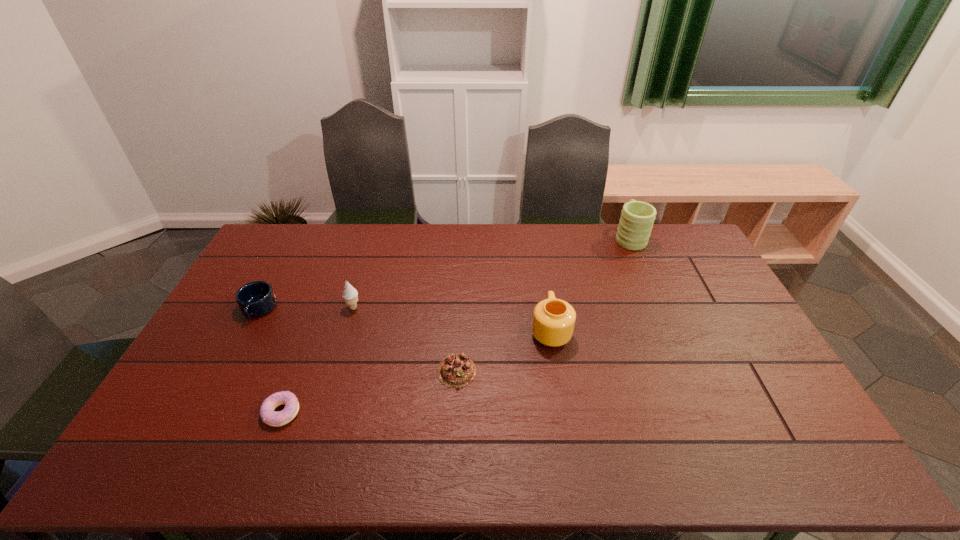
Where is `free space between the fifth farthest object and the shortest mug`? The width and height of the screenshot is (960, 540). free space between the fifth farthest object and the shortest mug is located at coordinates (357, 340).

The image size is (960, 540). Identify the location of free spot between the doughnut and the shortest mug. (270, 361).

The height and width of the screenshot is (540, 960). What are the coordinates of `unoccupied position between the fifth farthest object and the third shortest object` in the screenshot? It's located at (357, 340).

Select which object appears as the third closest to the fourth object from right to left. Please provide its 2D coordinates. Your answer should be formatted as a tuple, i.e. [(x, y)], where the tuple contains the x and y coordinates of a point satisfying the conditions above.

[(456, 370)]

The width and height of the screenshot is (960, 540). What are the coordinates of `object that is the fourth closest to the nearest object` in the screenshot? It's located at (553, 323).

Identify which mug is the closest to the farthest mug. Please provide its 2D coordinates. Your answer should be formatted as a tuple, i.e. [(x, y)], where the tuple contains the x and y coordinates of a point satisfying the conditions above.

[(553, 323)]

Identify which mug is the closest to the second shortest mug. Please provide its 2D coordinates. Your answer should be formatted as a tuple, i.e. [(x, y)], where the tuple contains the x and y coordinates of a point satisfying the conditions above.

[(637, 218)]

Locate an element on the screen. The height and width of the screenshot is (540, 960). vacant space that satisfies the following two spatial constraints: 1. with the handle on the side of the leftmost mug; 2. on the right side of the nearest object is located at coordinates (204, 412).

The height and width of the screenshot is (540, 960). What are the coordinates of `free space that satisfies the following two spatial constraints: 1. with the handle on the side of the chocolate cake; 2. on the left side of the leftmost object` in the screenshot? It's located at (226, 371).

At what (x,y) coordinates should I click in order to perform the action: click on blank area in the image that satisfies the following two spatial constraints: 1. with the handle on the side of the shortest mug; 2. on the left side of the fifth tallest object. Please return your answer as a coordinate pair (x, y). The image size is (960, 540). Looking at the image, I should click on (226, 371).